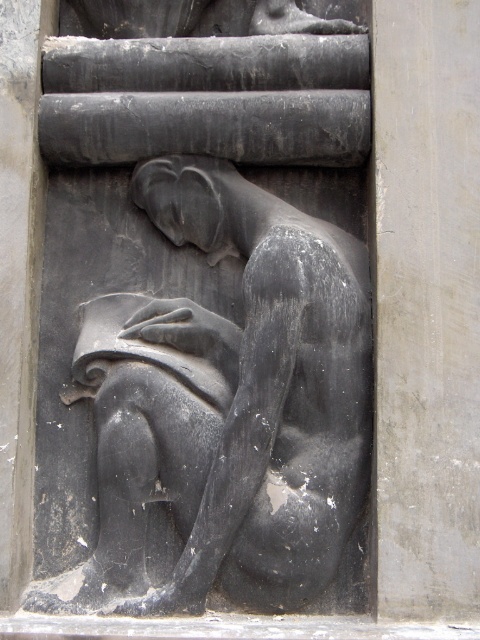
You are an archaeologist examining a stone relief sculpture. You notice a specific point at coordinates (229, 404). Based on the scene description, what object is located at this point?

The point at (229, 404) corresponds to the black stone sculpture at center.

You are an art conservator working on a restoration project. You need to place a protective barrier between the black stone sculpture at center and the gray stone pillar at center. The barrier must be at least 24 inches wide to be effective. Based on the scene, will the barrier fit between them?

The black stone sculpture at center is 23.91 inches from the gray stone pillar at center. Since the required barrier width is 24 inches, the distance is slightly insufficient. The barrier will not fit between them.

You are an art conservator assessing the stone relief sculpture and the pillar in the scene. Given that the black stone sculpture at center is larger than the gray stone pillar at center, which object would require more material for restoration if both were to be fully restored to their original sizes?

The black stone sculpture at center would require more material for restoration since it has a larger size compared to the gray stone pillar at center.